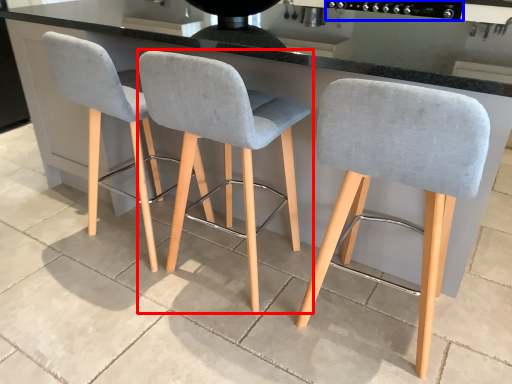
Question: Which of the following is the closest to the observer, chair (highlighted by a red box) or appliance (highlighted by a blue box)?

Choices:
 (A) chair
 (B) appliance

Answer: (A)